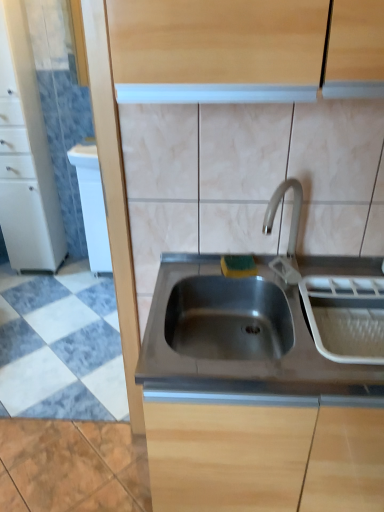
Question: Looking at the image, does stainless steel sink at center seem bigger or smaller compared to stainless steel sink at center, the first cabinetry positioned from the right?

Choices:
 (A) small
 (B) big

Answer: (A)

Question: Considering the positions of stainless steel sink at center and stainless steel sink at center, positioned as the 2th cabinetry in back-to-front order, in the image, is stainless steel sink at center taller or shorter than stainless steel sink at center, positioned as the 2th cabinetry in back-to-front order,?

Choices:
 (A) short
 (B) tall

Answer: (A)

Question: Which object is the closest to the stainless steel sink at center, placed as the second cabinetry when sorted from left to right?

Choices:
 (A) white marble floor at lower left
 (B) white plastic dish rack at right
 (C) white glossy cabinet at left, placed as the first cabinetry when sorted from top to bottom
 (D) stainless steel sink at center
 (E) white glossy dishwasher at left

Answer: (D)

Question: Considering the real-world distances, which object is farthest from the white marble floor at lower left?

Choices:
 (A) white glossy dishwasher at left
 (B) stainless steel sink at center, the second cabinetry from the top
 (C) white glossy cabinet at left, acting as the 2th cabinetry starting from the right
 (D) white plastic dish rack at right
 (E) stainless steel sink at center

Answer: (D)